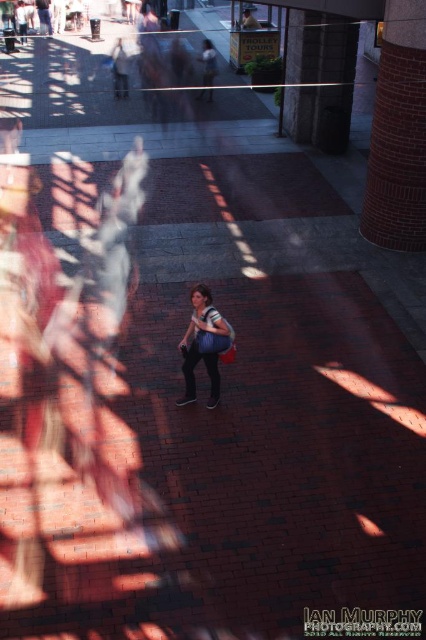
Question: Which of the following is the farthest from the observer?

Choices:
 (A) (218, 384)
 (B) (412, 147)

Answer: (B)

Question: Is brick textured pillar at right positioned at the back of matte blue shirt at center?

Choices:
 (A) yes
 (B) no

Answer: (A)

Question: Can you confirm if brick textured pillar at right is positioned to the left of matte blue shirt at center?

Choices:
 (A) yes
 (B) no

Answer: (B)

Question: Can you confirm if brick textured pillar at right is smaller than matte blue shirt at center?

Choices:
 (A) yes
 (B) no

Answer: (B)

Question: Which point is closer to the camera?

Choices:
 (A) (207, 404)
 (B) (386, 212)

Answer: (A)